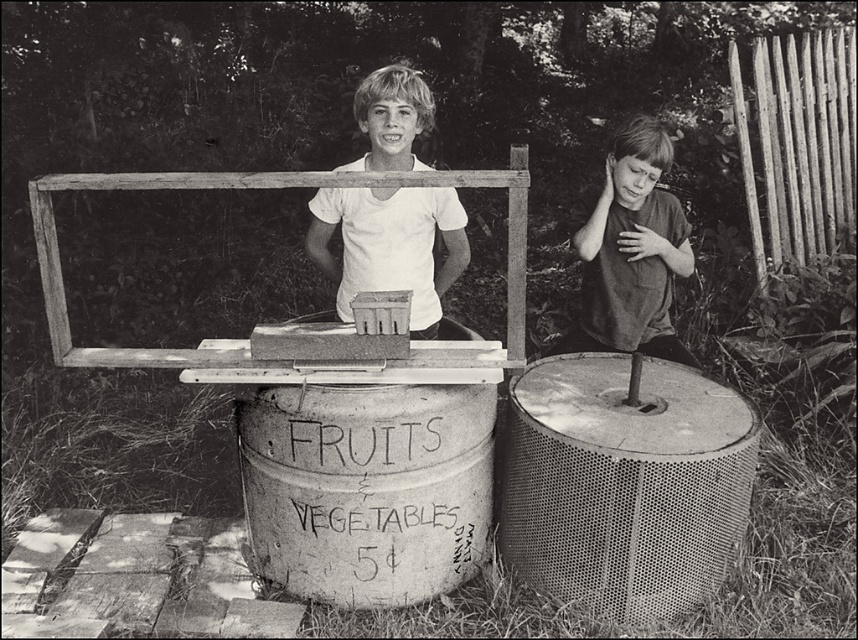
You are a photographer trying to capture both the white matte shirt at center and the dark gray shirt at right in a single frame. Based on their positions, which shirt is closer to the camera?

The white matte shirt at center is wider than the dark gray shirt at right, so it is closer to the camera.